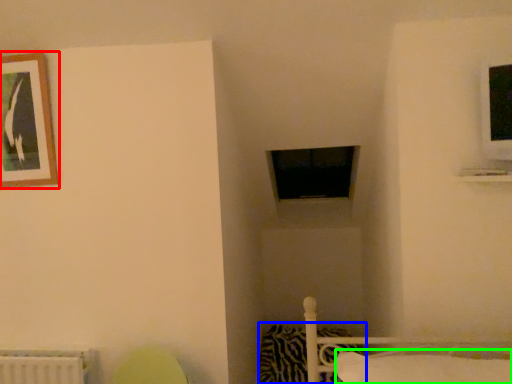
Question: Based on their relative distances, which object is farther from picture frame (highlighted by a red box)? Choose from pillow (highlighted by a blue box) and pillow (highlighted by a green box).

Choices:
 (A) pillow
 (B) pillow

Answer: (A)